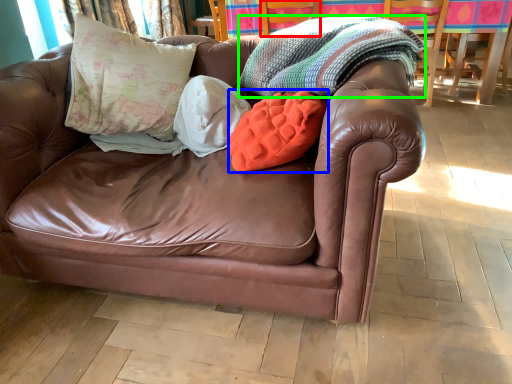
Question: Considering the real-world distances, which object is closest to armchair (highlighted by a red box)? throw pillow (highlighted by a blue box) or blanket (highlighted by a green box).

Choices:
 (A) throw pillow
 (B) blanket

Answer: (B)